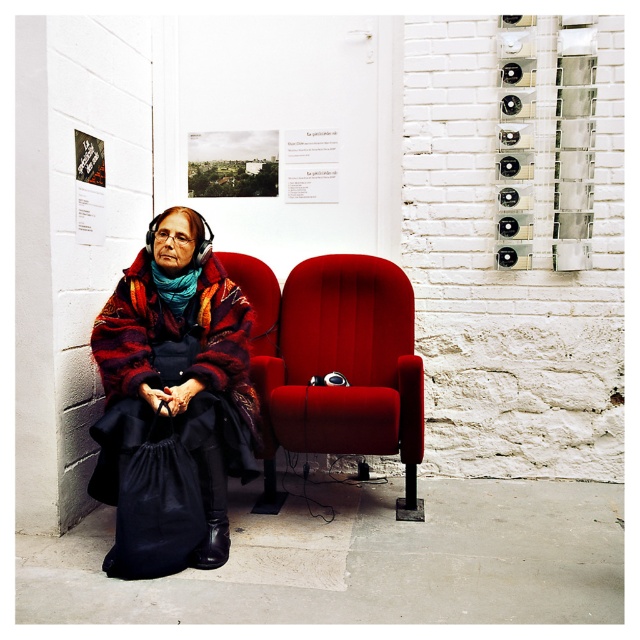
You are standing in the art gallery and want to place a teal knitted scarf at left on the velvet red armchair at center. Can you do this without moving the headphones that are already on the chair?

The velvet red armchair at center is to the right of the teal knitted scarf at left, so you can place the teal knitted scarf at left on the chair without moving the headphones as long as there is space available on the seat.

You are standing in the art gallery and notice two points marked in the scene. The first point is at coordinates point (301, 298) and the second point is at point (195, 291). Which of these points is closer to your viewpoint?

Point (195, 291) is closer to your viewpoint because it is less further to the camera than point (301, 298).